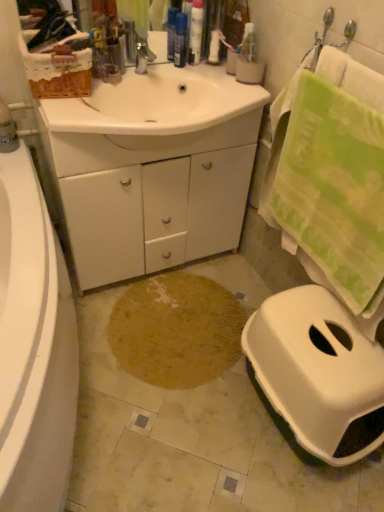
Question: Is translucent plastic bottles at upper center, the 3th toiletry from the right, to the right of brown textured rug at center from the viewer's perspective?

Choices:
 (A) no
 (B) yes

Answer: (B)

Question: Does translucent plastic bottles at upper center, the 3th toiletry from the right, have a lesser height compared to brown textured rug at center?

Choices:
 (A) no
 (B) yes

Answer: (A)

Question: Is translucent plastic bottles at upper center, marked as the first toiletry in a left-to-right arrangement, completely or partially outside of brown textured rug at center?

Choices:
 (A) no
 (B) yes

Answer: (B)

Question: Is translucent plastic bottles at upper center, marked as the first toiletry in a left-to-right arrangement, closer to camera compared to brown textured rug at center?

Choices:
 (A) yes
 (B) no

Answer: (B)

Question: From a real-world perspective, is translucent plastic bottles at upper center, the 3th toiletry from the right, positioned over brown textured rug at center based on gravity?

Choices:
 (A) no
 (B) yes

Answer: (B)

Question: From a real-world perspective, is translucent plastic bottles at upper center, marked as the first toiletry in a left-to-right arrangement, above or below white plastic bottle at upper center, marked as the first toiletry in a right-to-left arrangement?

Choices:
 (A) above
 (B) below

Answer: (A)

Question: Does point (177, 33) appear closer or farther from the camera than point (210, 61)?

Choices:
 (A) farther
 (B) closer

Answer: (A)

Question: In the image, is translucent plastic bottles at upper center, the 3th toiletry from the right, positioned in front of or behind white plastic bottle at upper center, which is the 3th toiletry in left-to-right order?

Choices:
 (A) front
 (B) behind

Answer: (A)

Question: Is translucent plastic bottles at upper center, marked as the first toiletry in a left-to-right arrangement, wider or thinner than white plastic bottle at upper center, marked as the first toiletry in a right-to-left arrangement?

Choices:
 (A) wide
 (B) thin

Answer: (A)

Question: From the image's perspective, is brown textured rug at center positioned above or below white glossy cabinet at center?

Choices:
 (A) below
 (B) above

Answer: (A)

Question: Considering the positions of brown textured rug at center and white glossy cabinet at center in the image, is brown textured rug at center wider or thinner than white glossy cabinet at center?

Choices:
 (A) wide
 (B) thin

Answer: (A)

Question: Relative to white glossy cabinet at center, is brown textured rug at center in front or behind?

Choices:
 (A) front
 (B) behind

Answer: (B)

Question: Looking at the image, does brown textured rug at center seem bigger or smaller compared to white glossy cabinet at center?

Choices:
 (A) small
 (B) big

Answer: (A)

Question: Looking at their shapes, would you say white plastic bottle at upper center, marked as the first toiletry in a right-to-left arrangement, is wider or thinner than white glossy cabinet at center?

Choices:
 (A) thin
 (B) wide

Answer: (A)

Question: Based on their positions, is white plastic bottle at upper center, which is the 3th toiletry in left-to-right order, located to the left or right of white glossy cabinet at center?

Choices:
 (A) right
 (B) left

Answer: (A)